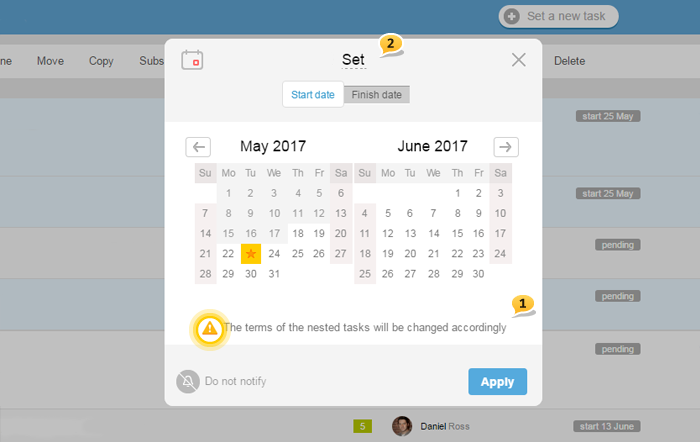
The width and height of the screenshot is (700, 442). I want to click on calendars, so click(407, 165), click(250, 179).